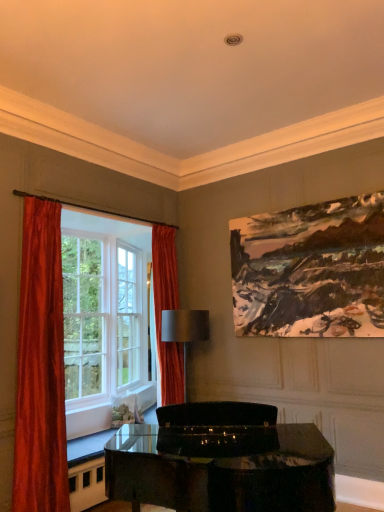
Question: Considering the positions of orange velvet curtain at left, which appears as the 1th curtain when viewed from the back, and satin gray lampshade at center in the image, is orange velvet curtain at left, which appears as the 1th curtain when viewed from the back, taller or shorter than satin gray lampshade at center?

Choices:
 (A) tall
 (B) short

Answer: (A)

Question: Is point (177, 273) closer or farther from the camera than point (165, 336)?

Choices:
 (A) closer
 (B) farther

Answer: (B)

Question: Which object is positioned farthest from the glossy black piano at center?

Choices:
 (A) oil painting at upper right
 (B) velvet orange curtain at left, placed as the 2th curtain when sorted from back to front
 (C) orange velvet curtain at left, which appears as the first curtain when viewed from the right
 (D) satin gray lampshade at center
 (E) silky red curtains at left

Answer: (C)

Question: Estimate the real-world distances between objects in this image. Which object is closer to the silky red curtains at left?

Choices:
 (A) glossy black piano at center
 (B) velvet orange curtain at left, placed as the 2th curtain when sorted from back to front
 (C) oil painting at upper right
 (D) orange velvet curtain at left, which appears as the 1th curtain when viewed from the back
 (E) satin gray lampshade at center

Answer: (D)